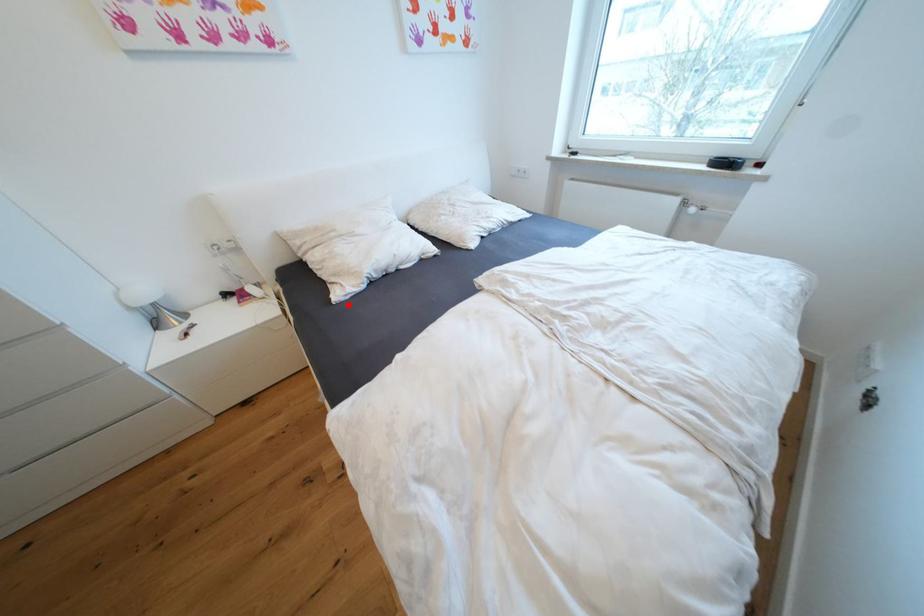
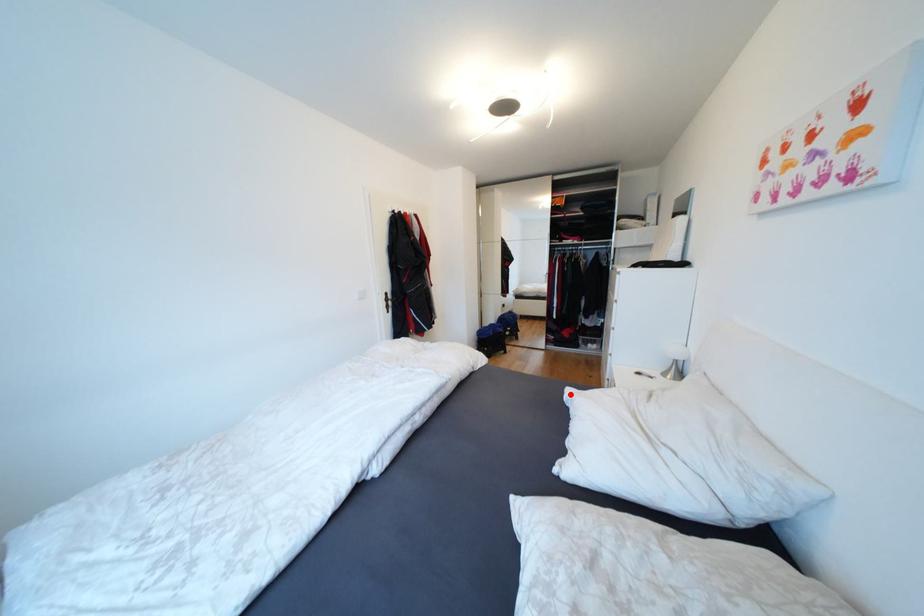
I am providing you with two images of the same scene from different viewpoints. A red point is marked on the first image and another point is marked on the second image. Are the points marked in image1 and image2 representing the same 3D position?

Yes